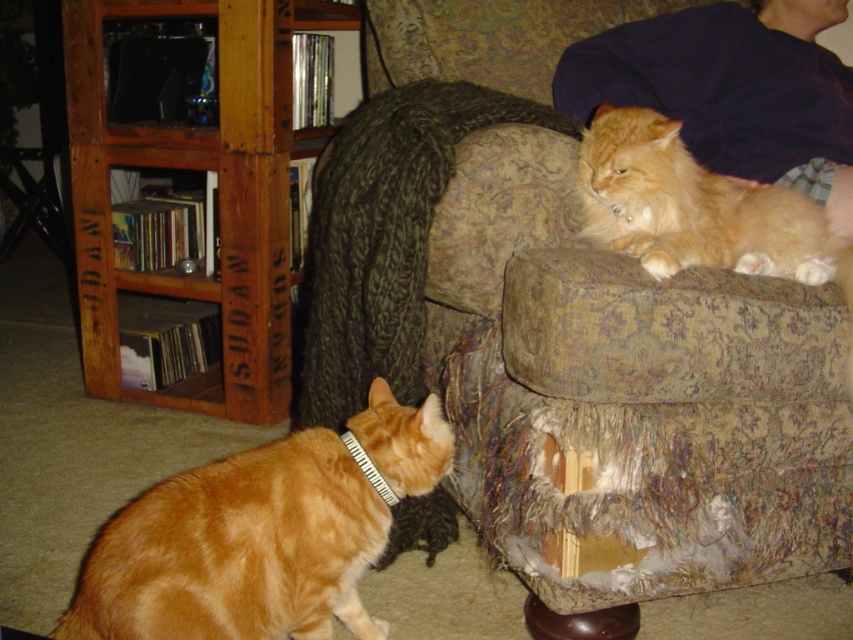
You are a cat owner trying to separate your two cats. You see the orange fur cat at lower left and the orange fur cat at upper right. Which cat is closer to you and should you approach first?

The orange fur cat at lower left is closer to you since it is in front of the orange fur cat at upper right, so you should approach the orange fur cat at lower left first.

Based on the photo, you are a cat owner who wants to place a new cat bed on the patterned fabric couch at upper center. However, you notice the black fabric neckband at lower left. Is the couch above or below the neckband?

The patterned fabric couch at upper center is positioned over the black fabric neckband at lower left, so the couch is above the neckband.

You are a cat owner who wants to place a new cat tree in the living room. The cat tree is 1.2 meters tall. Considering the height of the orange fur cat at lower left and the patterned fabric couch at upper center, will the cat tree fit between them vertically?

The orange fur cat at lower left is shorter than the patterned fabric couch at upper center. Since the cat tree is 1.2 meters tall, it depends on the actual height of the couch. If the couch is taller than 1.2 meters, the cat tree can fit below it. However, without specific measurements, we can only confirm that the cat tree is taller than the cat but may or may not fit under the couch.